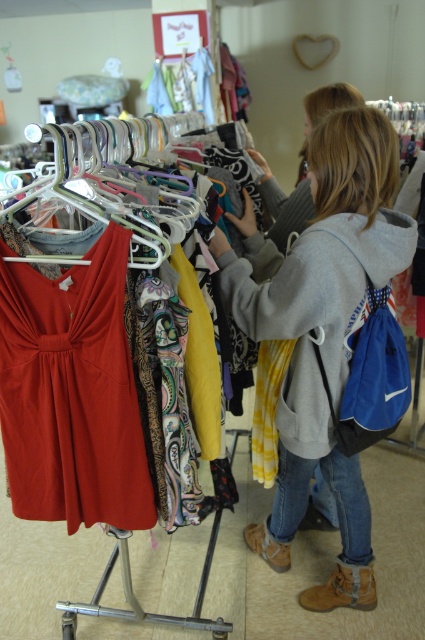
Describe the element at coordinates (71, 394) in the screenshot. I see `matte red dress at center` at that location.

Which is above, matte red dress at center or yellow tie-dye shirt at center?

matte red dress at center

Who is more distant from viewer, (110, 280) or (348, 244)?

The point (348, 244) is more distant.

The height and width of the screenshot is (640, 425). I want to click on matte red dress at center, so tap(71, 394).

What do you see at coordinates (71, 394) in the screenshot? The height and width of the screenshot is (640, 425). I see `matte red dress at center` at bounding box center [71, 394].

Who is positioned more to the left, matte red dress at center or metallic silver hanger at upper left?

Positioned to the left is matte red dress at center.

Is point (119, 397) closer to viewer compared to point (90, 195)?

No, it is not.

At what (x,y) coordinates should I click in order to perform the action: click on matte red dress at center. Please return your answer as a coordinate pair (x, y). Looking at the image, I should click on (71, 394).

Who is shorter, yellow tie-dye shirt at center or metallic silver hanger at upper left?

metallic silver hanger at upper left

The image size is (425, 640). I want to click on yellow tie-dye shirt at center, so click(x=314, y=360).